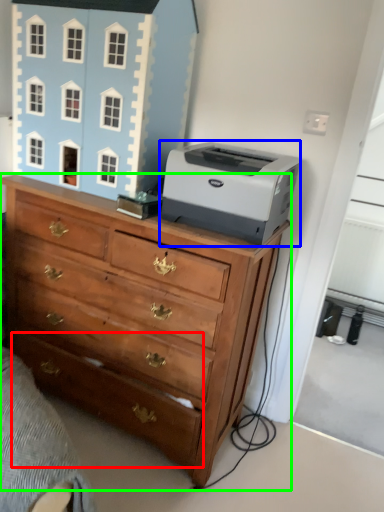
Question: Based on their relative distances, which object is nearer to drawer (highlighted by a red box)? Choose from printer (highlighted by a blue box) and chest of drawers (highlighted by a green box).

Choices:
 (A) printer
 (B) chest of drawers

Answer: (B)